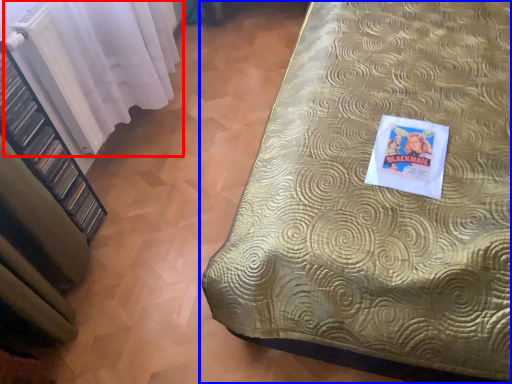
Question: Which of the following is the closest to the observer, curtain (highlighted by a red box) or bed (highlighted by a blue box)?

Choices:
 (A) curtain
 (B) bed

Answer: (B)